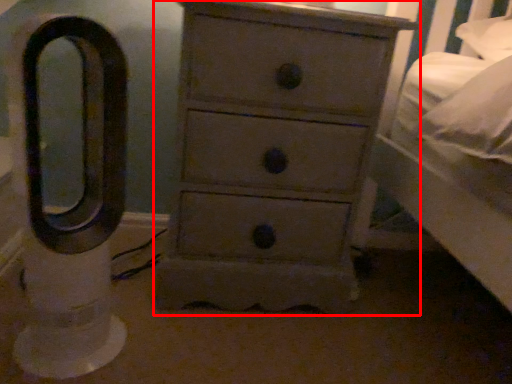
Question: From the image's perspective, what is the correct spatial relationship of chest of drawers (annotated by the red box) in relation to swivel chair?

Choices:
 (A) below
 (B) above

Answer: (B)